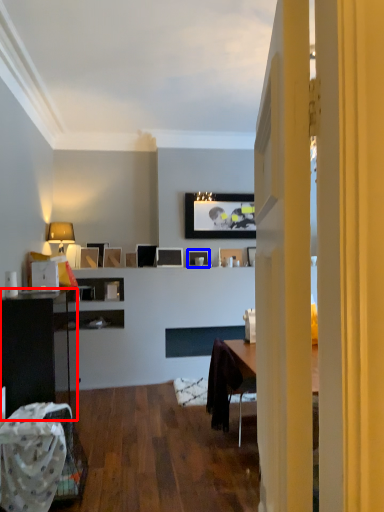
Question: Among these objects, which one is nearest to the camera, cabinetry (highlighted by a red box) or picture frame (highlighted by a blue box)?

Choices:
 (A) cabinetry
 (B) picture frame

Answer: (A)